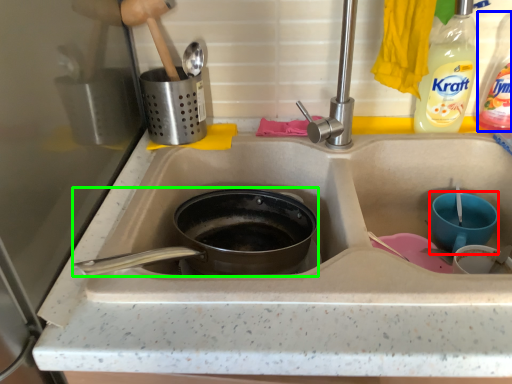
Question: Considering the real-world distances, which object is closest to basin (highlighted by a red box)? bottle (highlighted by a blue box) or frying pan (highlighted by a green box).

Choices:
 (A) bottle
 (B) frying pan

Answer: (A)